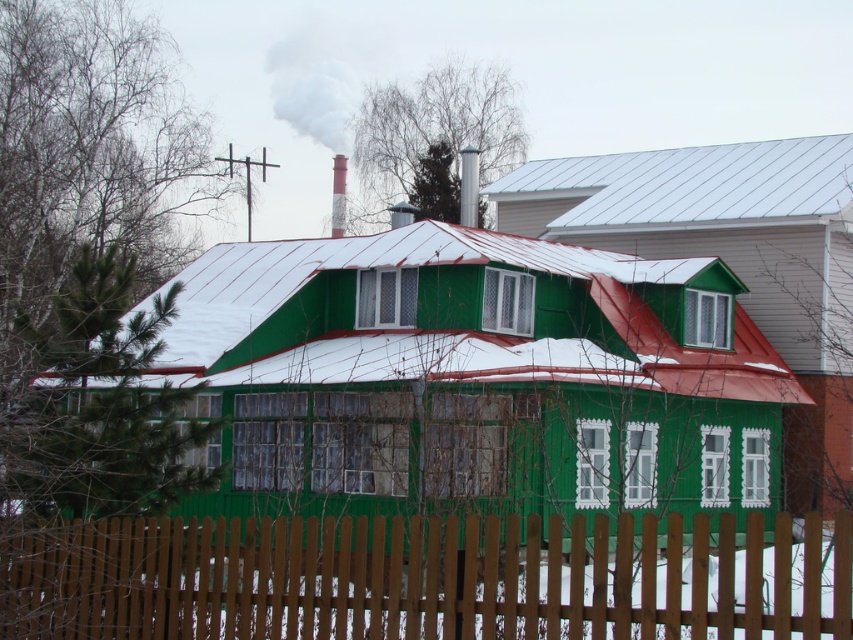
Question: Can you confirm if white smoke at upper center is positioned below smooth brick chimney at upper center?

Choices:
 (A) yes
 (B) no

Answer: (B)

Question: Which of the following is the farthest from the observer?

Choices:
 (A) (431, 584)
 (B) (341, 221)

Answer: (B)

Question: Is brown wooden fence at lower center wider than smooth metallic chimney at upper center?

Choices:
 (A) no
 (B) yes

Answer: (B)

Question: Estimate the real-world distances between objects in this image. Which object is closer to the brown wooden fence at lower center?

Choices:
 (A) smooth metallic chimney at upper center
 (B) smooth brick chimney at upper center

Answer: (A)

Question: Based on their relative distances, which object is farther from the white smoke at upper center?

Choices:
 (A) green painted wood at center
 (B) smooth metallic chimney at upper center
 (C) smooth brick chimney at upper center

Answer: (A)

Question: Is green painted wood at center above smooth brick chimney at upper center?

Choices:
 (A) no
 (B) yes

Answer: (A)